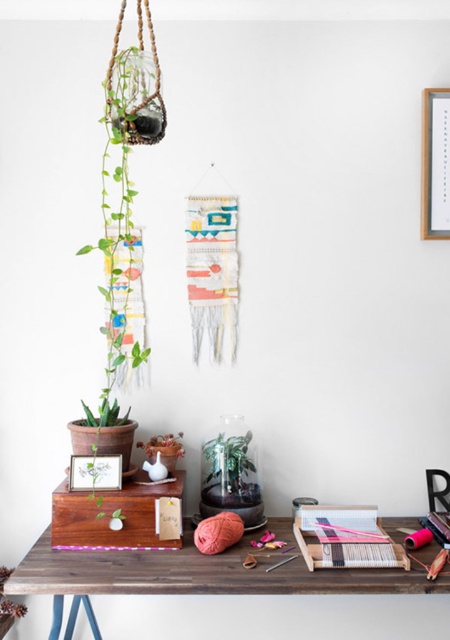
You are organizing a small shelf in the workspace and need to place the wooden table at lower center and the wooden picture frame at upper right. Which object should be placed higher on the shelf to ensure stability?

The wooden picture frame at upper right should be placed higher on the shelf because it is taller than the wooden table at lower center, which helps in maintaining stability by lowering its center of gravity.

You are organizing the desk and need to place a new item between the wooden picture frame at upper right and the green matte plant at center. Which object should you place closer to you to maintain the existing spatial arrangement?

The wooden picture frame at upper right is already closer to you than the green matte plant at center, so you should place the new item closer to the wooden picture frame at upper right to maintain the existing spatial arrangement.

You are organizing the desk and need to place a new item between the wooden picture frame at upper right and the terrarium. Where should you position the new item?

The wooden picture frame at upper right is located at point (435, 164), so you should place the new item between the wooden picture frame at upper right and the terrarium by positioning it closer to the wooden picture frame at upper right since the terrarium is on the left side of the desk.